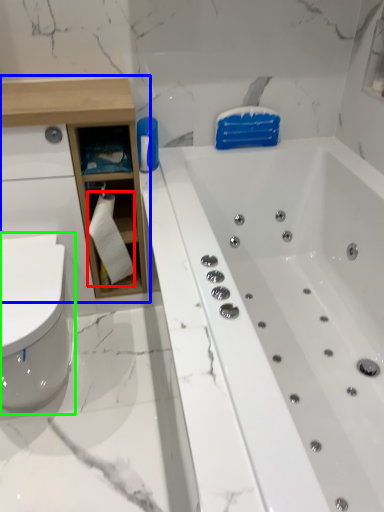
Question: Which object is the closest to the toilet paper (highlighted by a red box)? Choose among these: cabinetry (highlighted by a blue box) or toilet (highlighted by a green box).

Choices:
 (A) cabinetry
 (B) toilet

Answer: (A)